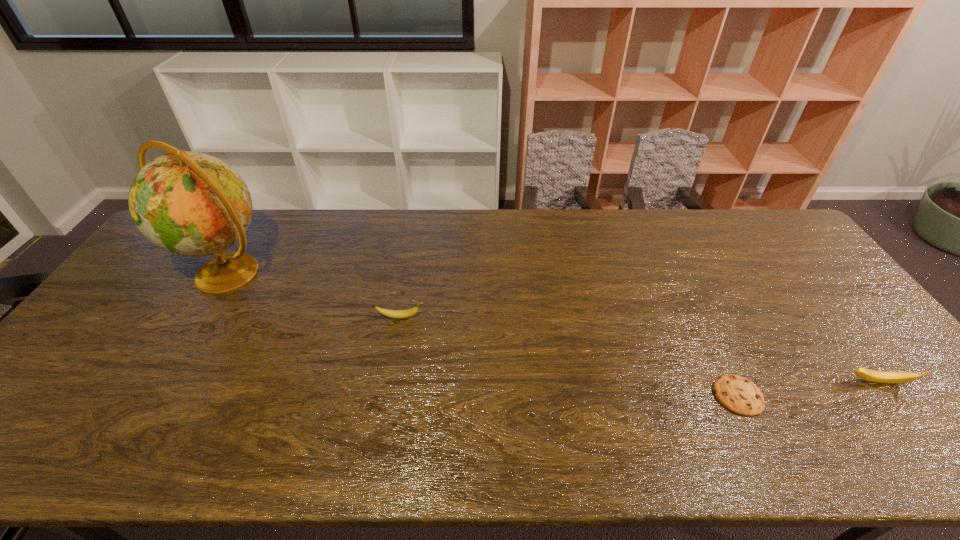
You are a GUI agent. You are given a task and a screenshot of the screen. Output one action in this format:
    pyautogui.click(x=<x>, y=<y>)
    Task: Click on the globe
    The height and width of the screenshot is (540, 960).
    Given the screenshot: What is the action you would take?
    pyautogui.click(x=191, y=204)

Find the location of a particular element. Image resolution: width=960 pixels, height=540 pixels. the leftmost object is located at coordinates [x=191, y=204].

I want to click on the third object from right to left, so click(397, 314).

Where is `the left banana`? Image resolution: width=960 pixels, height=540 pixels. the left banana is located at coordinates (397, 314).

Locate an element on the screen. This screenshot has width=960, height=540. the right banana is located at coordinates (868, 375).

Where is `the rightmost object`? the rightmost object is located at coordinates (868, 375).

Find the location of a particular element. The image size is (960, 540). the shortest object is located at coordinates (739, 395).

At what (x,y) coordinates should I click in order to perform the action: click on the second object from right to left. Please return your answer as a coordinate pair (x, y). Looking at the image, I should click on (739, 395).

This screenshot has height=540, width=960. I want to click on blank area located on the right of the tallest object, so click(300, 273).

This screenshot has width=960, height=540. What are the coordinates of `free point located at the stem of the second object from left to right` in the screenshot? It's located at (486, 317).